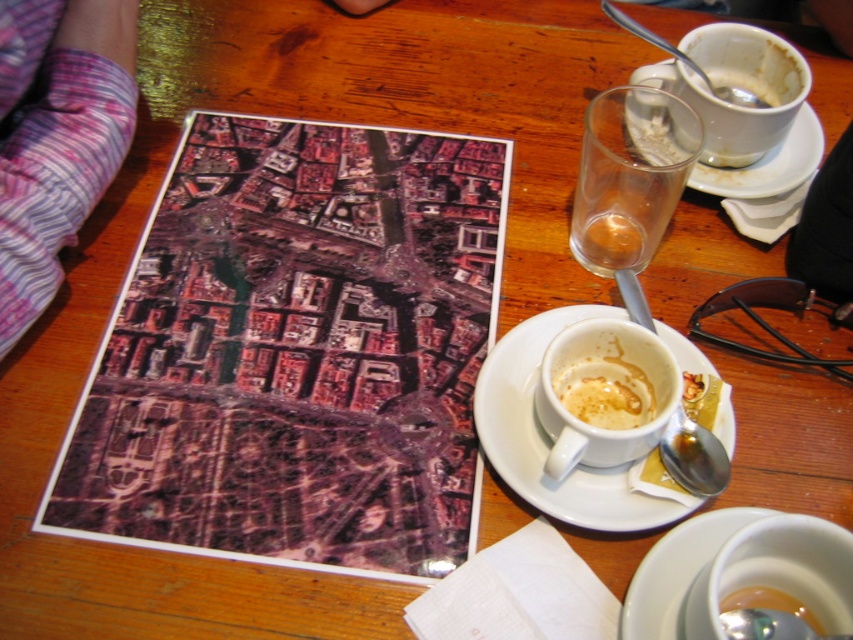
You are a guest at a tea party and want to choose the smaller cup for your tea. Which one should you pick between the matte white cup at center and the white matte cup at upper right?

You should pick the matte white cup at center because it is smaller than the white matte cup at upper right.

You are sitting at the wooden table and want to grab the transparent glass at upper right without moving the purple striped socks at lower left. Is this possible?

The purple striped socks at lower left is to the left of transparent glass at upper right, so yes, you can grab the transparent glass at upper right without moving the purple striped socks at lower left since they are positioned to the left of it.